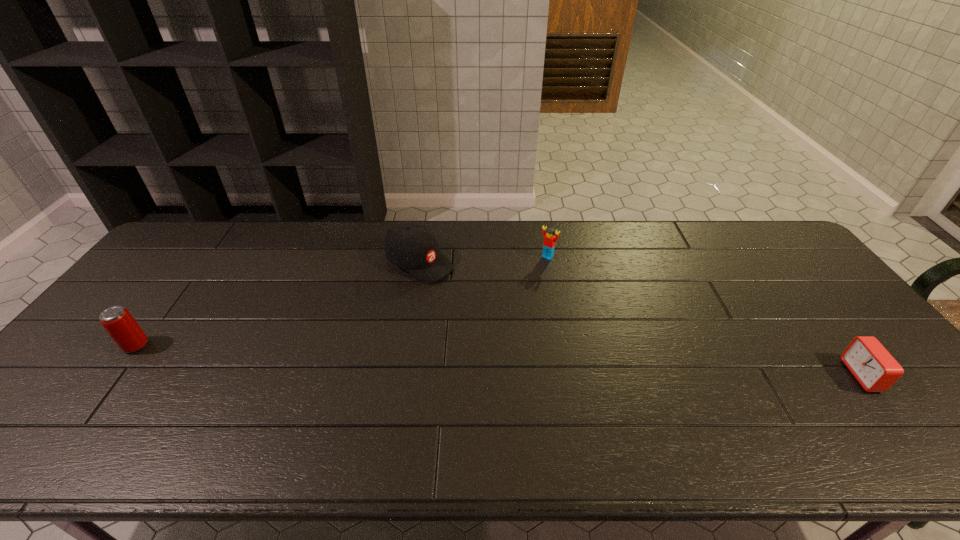
The image size is (960, 540). Find the location of `free space located 0.080m on the face of the Lego`. free space located 0.080m on the face of the Lego is located at coordinates (532, 273).

Identify the location of free space located 0.110m on the face of the Lego. (527, 278).

Identify the location of vacant area located 0.180m on the face of the Lego. (516, 291).

Locate an element on the screen. Image resolution: width=960 pixels, height=540 pixels. free region located 0.250m with a logo on the front of the third object from right to left is located at coordinates (509, 313).

Where is `free space located 0.350m with a logo on the front of the third object from right to left`? This screenshot has width=960, height=540. free space located 0.350m with a logo on the front of the third object from right to left is located at coordinates (538, 330).

You are a GUI agent. You are given a task and a screenshot of the screen. Output one action in this format:
    pyautogui.click(x=<x>, y=<y>)
    Task: Click on the free space located with a logo on the front of the third object from right to left
    This screenshot has width=960, height=540.
    Given the screenshot: What is the action you would take?
    pyautogui.click(x=495, y=305)

I want to click on Lego located at the far edge, so click(x=549, y=240).

Find the location of a particular element. Image resolution: width=960 pixels, height=540 pixels. baseball cap that is at the far edge is located at coordinates (413, 247).

This screenshot has width=960, height=540. I want to click on object present at the near edge, so click(x=875, y=369).

Locate an element on the screen. The width and height of the screenshot is (960, 540). object that is at the left edge is located at coordinates (124, 330).